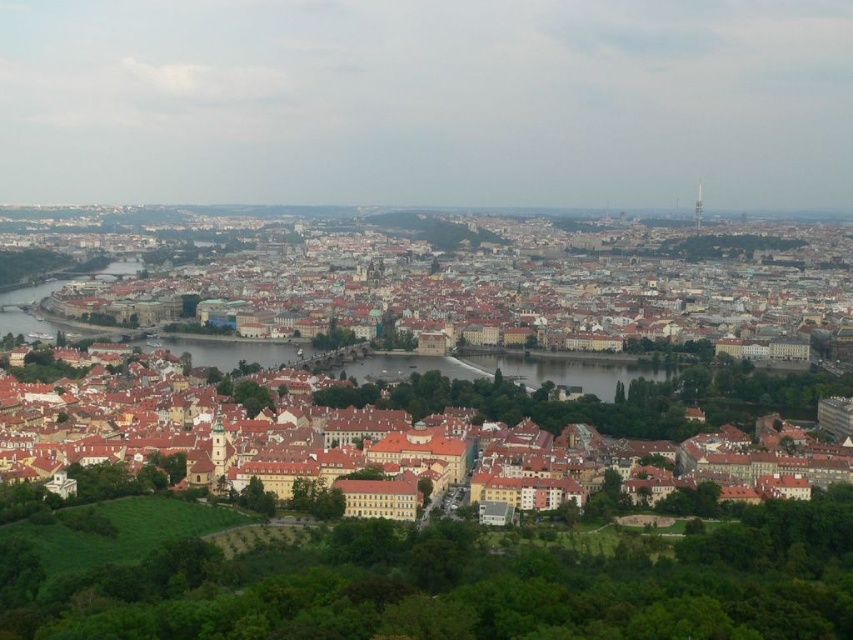
You are standing at a viewpoint overlooking the Charles Bridge and the Vltava River. You notice two points marked in the scene. The first point is located at coordinates point [289,259] and the second at point [550,428]. Which of these two points is closer to your current position?

Point [289,259] is closer to your current position because it is further to the viewer than point [550,428].

You are a drone operator flying over the city. Your task is to capture aerial footage of the brown tiled roofs at center and the brown textured buildings at center. Which object should you fly closer to in order to fully capture its height in the footage?

The brown tiled roofs at center is much taller than the brown textured buildings at center, so you should fly closer to the brown tiled roofs at center to fully capture its height in the footage.

You are an architect analyzing the city layout. Based on the scene, which object occupies more horizontal space in the image? The brown tiled roofs at center or the brown textured buildings at center?

The brown tiled roofs at center might be wider than brown textured buildings at center.